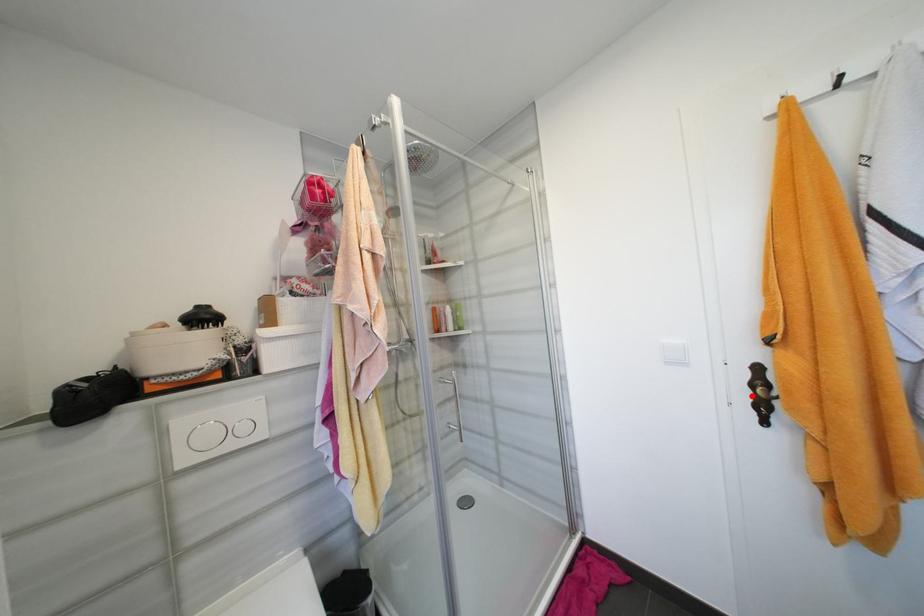
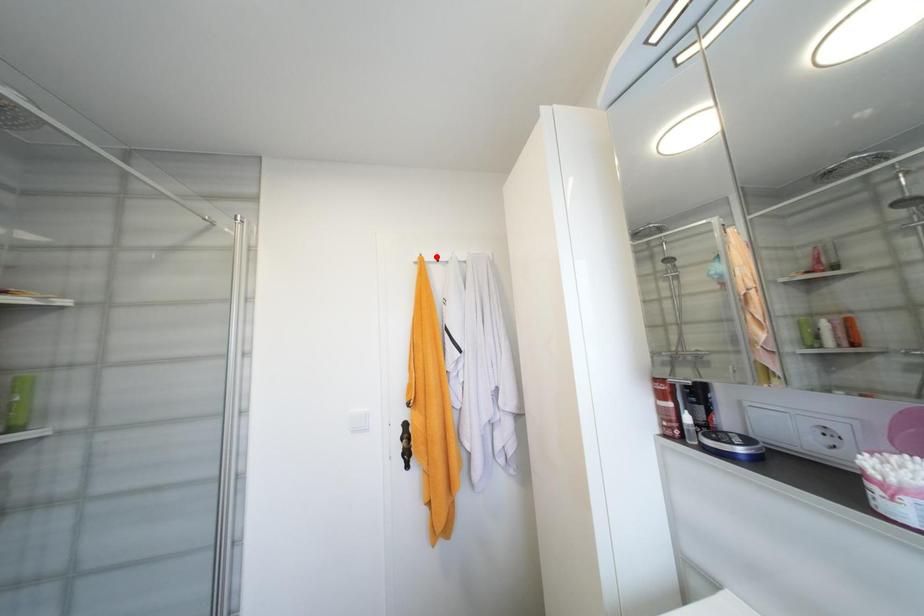
I am providing you with two images of the same scene from different viewpoints. A red point is marked on the first image and another point is marked on the second image. Is the red point in image1 aligned with the point shown in image2?

A: No